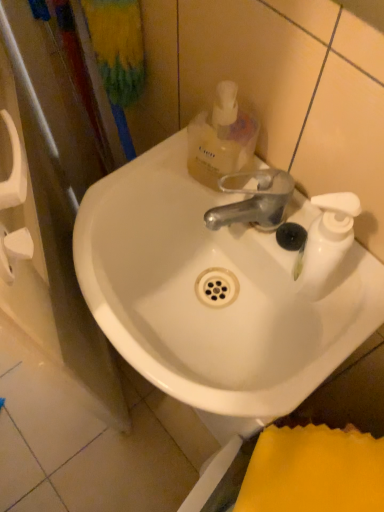
Question: Does translucent plastic mouthwash at upper center have a greater height compared to white glossy sink at center?

Choices:
 (A) yes
 (B) no

Answer: (A)

Question: Considering the relative sizes of translucent plastic mouthwash at upper center and white glossy sink at center in the image provided, is translucent plastic mouthwash at upper center wider than white glossy sink at center?

Choices:
 (A) no
 (B) yes

Answer: (A)

Question: Does translucent plastic mouthwash at upper center have a lesser height compared to white glossy sink at center?

Choices:
 (A) no
 (B) yes

Answer: (A)

Question: Considering the relative sizes of translucent plastic mouthwash at upper center and white glossy sink at center in the image provided, is translucent plastic mouthwash at upper center smaller than white glossy sink at center?

Choices:
 (A) yes
 (B) no

Answer: (A)

Question: Does translucent plastic mouthwash at upper center have a lesser width compared to white glossy sink at center?

Choices:
 (A) no
 (B) yes

Answer: (B)

Question: From the image's perspective, is translucent plastic mouthwash at upper center located beneath white glossy sink at center?

Choices:
 (A) no
 (B) yes

Answer: (A)

Question: Does white glossy sink at center have a lesser height compared to translucent plastic mouthwash at upper center?

Choices:
 (A) no
 (B) yes

Answer: (B)

Question: From a real-world perspective, is white glossy sink at center physically above translucent plastic mouthwash at upper center?

Choices:
 (A) no
 (B) yes

Answer: (A)

Question: Is white glossy sink at center far away from translucent plastic mouthwash at upper center?

Choices:
 (A) yes
 (B) no

Answer: (B)

Question: From the image's perspective, is white glossy sink at center above translucent plastic mouthwash at upper center?

Choices:
 (A) no
 (B) yes

Answer: (A)

Question: Is white glossy sink at center next to translucent plastic mouthwash at upper center?

Choices:
 (A) yes
 (B) no

Answer: (B)

Question: Is white glossy sink at center taller than translucent plastic mouthwash at upper center?

Choices:
 (A) no
 (B) yes

Answer: (A)

Question: Looking at their shapes, would you say white glossy sink at center is wider or thinner than translucent plastic mouthwash at upper center?

Choices:
 (A) thin
 (B) wide

Answer: (B)